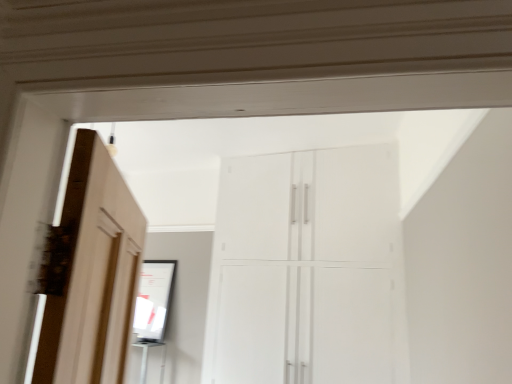
Locate an element on the screen. The image size is (512, 384). white glossy cupboard at center is located at coordinates (305, 268).

Image resolution: width=512 pixels, height=384 pixels. What do you see at coordinates (305, 268) in the screenshot?
I see `white glossy cupboard at center` at bounding box center [305, 268].

In order to click on matte black mirror at center in this screenshot , I will do `click(153, 300)`.

In order to face matte black mirror at center, should I rotate leftwards or rightwards?

A 13.657 degree turn to the left will do.

Image resolution: width=512 pixels, height=384 pixels. Describe the element at coordinates (153, 300) in the screenshot. I see `matte black mirror at center` at that location.

Locate an element on the screen. This screenshot has height=384, width=512. white glossy cupboard at center is located at coordinates (305, 268).

Between white glossy cupboard at center and matte black mirror at center, which one appears on the right side from the viewer's perspective?

From the viewer's perspective, white glossy cupboard at center appears more on the right side.

Considering their positions, is white glossy cupboard at center located in front of or behind matte black mirror at center?

white glossy cupboard at center is in front of matte black mirror at center.

Does point (291, 305) appear closer or farther from the camera than point (153, 298)?

Point (291, 305) is closer to the camera than point (153, 298).

From the image's perspective, is white glossy cupboard at center located above or below matte black mirror at center?

From the image's perspective, white glossy cupboard at center appears above matte black mirror at center.

From a real-world perspective, which object stands above the other?

From a 3D spatial view, white glossy cupboard at center is above.

Does white glossy cupboard at center have a lesser width compared to matte black mirror at center?

No.

Consider the image. Can you confirm if white glossy cupboard at center is taller than matte black mirror at center?

Correct, white glossy cupboard at center is much taller as matte black mirror at center.

Which of these two, white glossy cupboard at center or matte black mirror at center, is bigger?

white glossy cupboard at center.

Is matte black mirror at center completely or partially inside white glossy cupboard at center?

Actually, matte black mirror at center is outside white glossy cupboard at center.

Is white glossy cupboard at center far from matte black mirror at center?

Absolutely, white glossy cupboard at center is distant from matte black mirror at center.

Is white glossy cupboard at center facing away from matte black mirror at center?

white glossy cupboard at center is not turned away from matte black mirror at center.

Locate an element on the screen. Image resolution: width=512 pixels, height=384 pixels. cupboard to the right of matte black mirror at center is located at coordinates (305, 268).

Is matte black mirror at center at the right side of white glossy cupboard at center?

Incorrect, matte black mirror at center is not on the right side of white glossy cupboard at center.

Considering their positions, is matte black mirror at center located in front of or behind white glossy cupboard at center?

Clearly, matte black mirror at center is behind white glossy cupboard at center.

Considering the positions of point (155, 288) and point (270, 335), is point (155, 288) closer or farther from the camera than point (270, 335)?

Point (155, 288) is positioned farther from the camera compared to point (270, 335).

From the image's perspective, which one is positioned lower, matte black mirror at center or white glossy cupboard at center?

matte black mirror at center.

From a real-world perspective, is matte black mirror at center positioned over white glossy cupboard at center based on gravity?

No.

Between matte black mirror at center and white glossy cupboard at center, which one has larger width?

white glossy cupboard at center is wider.

Considering the sizes of objects matte black mirror at center and white glossy cupboard at center in the image provided, who is shorter, matte black mirror at center or white glossy cupboard at center?

matte black mirror at center is shorter.

In the scene shown: Between matte black mirror at center and white glossy cupboard at center, which one has smaller size?

Smaller between the two is matte black mirror at center.

Does matte black mirror at center contain white glossy cupboard at center?

No, white glossy cupboard at center is not a part of matte black mirror at center.

Would you say matte black mirror at center is a long distance from white glossy cupboard at center?

Indeed, matte black mirror at center is not near white glossy cupboard at center.

Is matte black mirror at center facing towards white glossy cupboard at center?

No.

I want to click on mirror behind the white glossy cupboard at center, so click(153, 300).

Locate an element on the screen. The image size is (512, 384). mirror below the white glossy cupboard at center (from the image's perspective) is located at coordinates (153, 300).

Image resolution: width=512 pixels, height=384 pixels. Identify the location of mirror behind the white glossy cupboard at center. (153, 300).